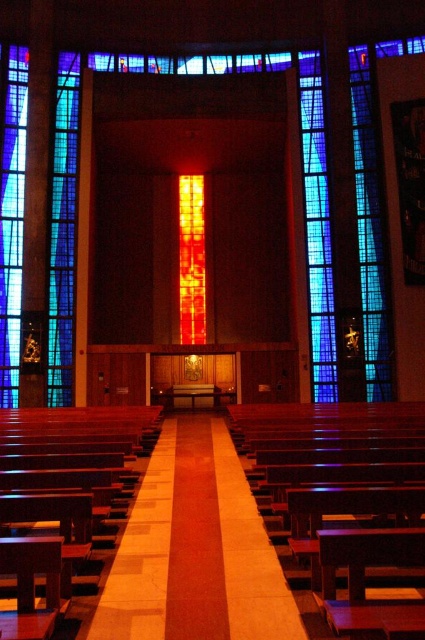
Between point (260, 525) and point (57, 561), which one is positioned in front?

Point (57, 561) is in front.

Between wooden aisle at center and mahogany wood church bench at lower left, which one is positioned higher?

Positioned higher is mahogany wood church bench at lower left.

Who is more distant from viewer, (258, 612) or (44, 529)?

Positioned behind is point (44, 529).

The width and height of the screenshot is (425, 640). What are the coordinates of `wooden aisle at center` in the screenshot? It's located at (195, 548).

What do you see at coordinates (346, 506) in the screenshot? I see `wooden church bench at center` at bounding box center [346, 506].

Who is taller, wooden church bench at center or wooden aisle at center?

wooden church bench at center is taller.

Between point (289, 445) and point (203, 602), which one is positioned in front?

Point (203, 602) is more forward.

The image size is (425, 640). Find the location of `wooden church bench at center`. wooden church bench at center is located at coordinates (346, 506).

Who is lower down, wooden church bench at center or translucent stained glass at left?

wooden church bench at center is below.

Can you confirm if wooden church bench at center is positioned to the right of translucent stained glass at left?

Indeed, wooden church bench at center is positioned on the right side of translucent stained glass at left.

Find the location of a particular element. The image size is (425, 640). wooden church bench at center is located at coordinates (346, 506).